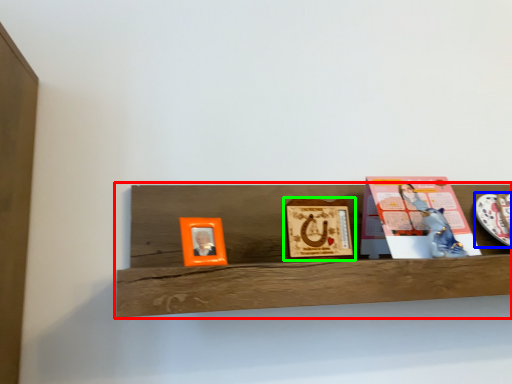
Question: Which is farther away from shelf (highlighted by a red box)? platter (highlighted by a blue box) or picture frame (highlighted by a green box)?

Choices:
 (A) platter
 (B) picture frame

Answer: (A)